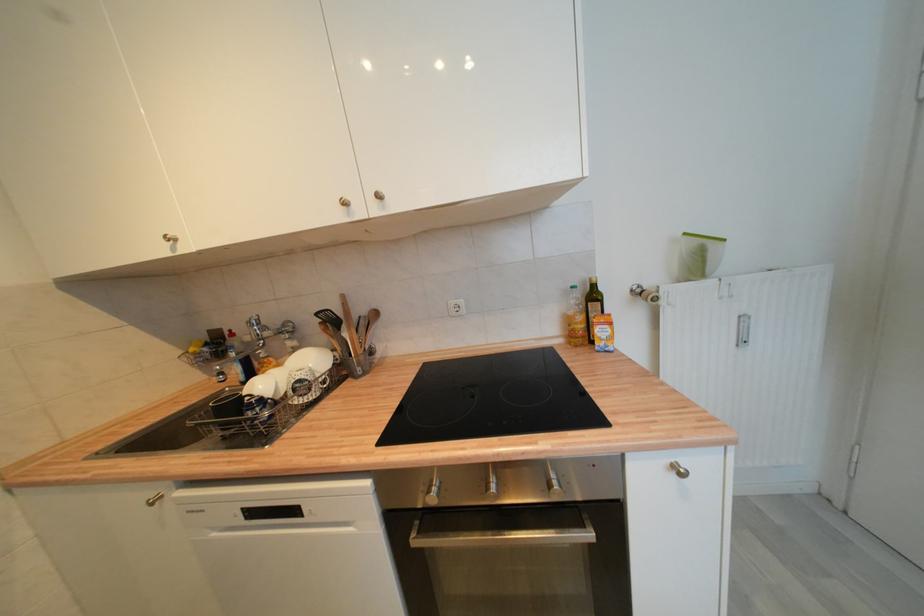
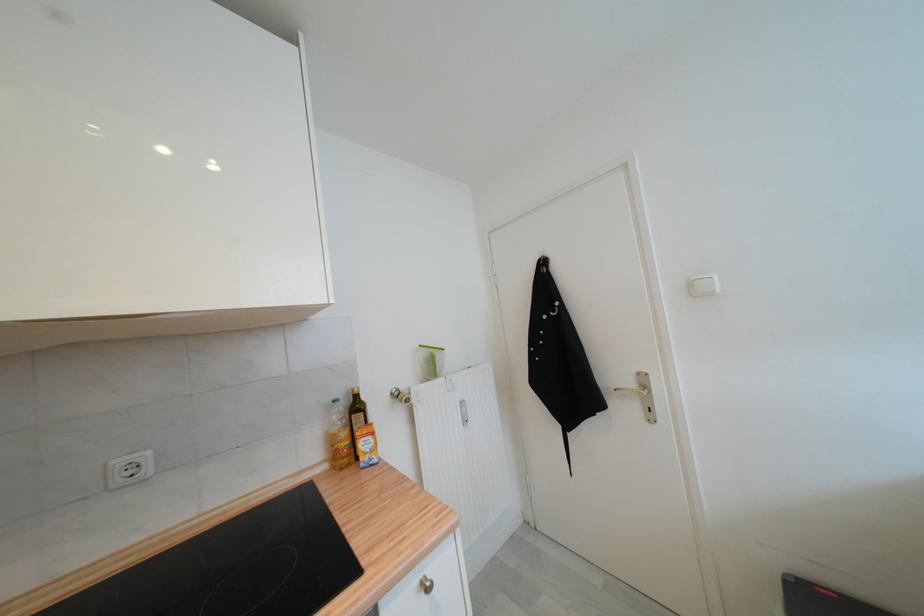
Locate, in the second image, the point that corresponds to point (456, 305) in the first image.

(126, 464)